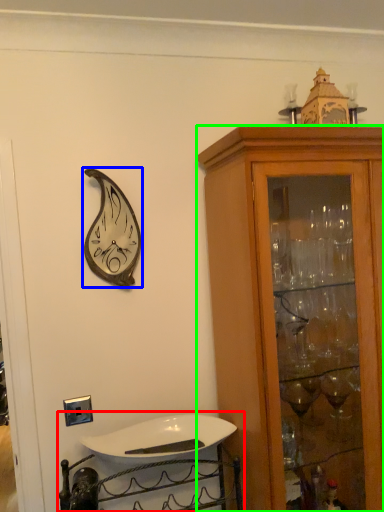
Question: Which object is positioned farthest from sink (highlighted by a red box)? Select from clock (highlighted by a blue box) and cabinetry (highlighted by a green box).

Choices:
 (A) clock
 (B) cabinetry

Answer: (A)